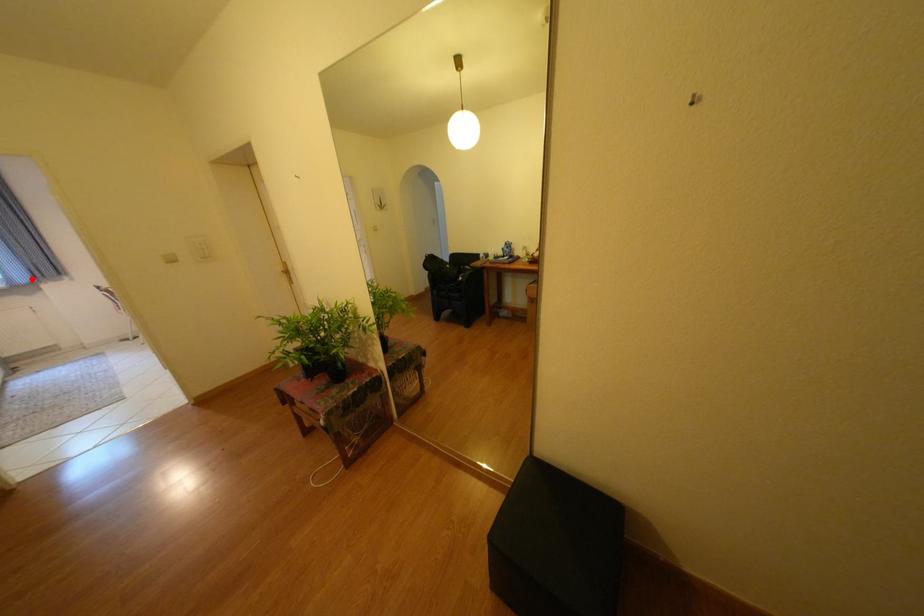
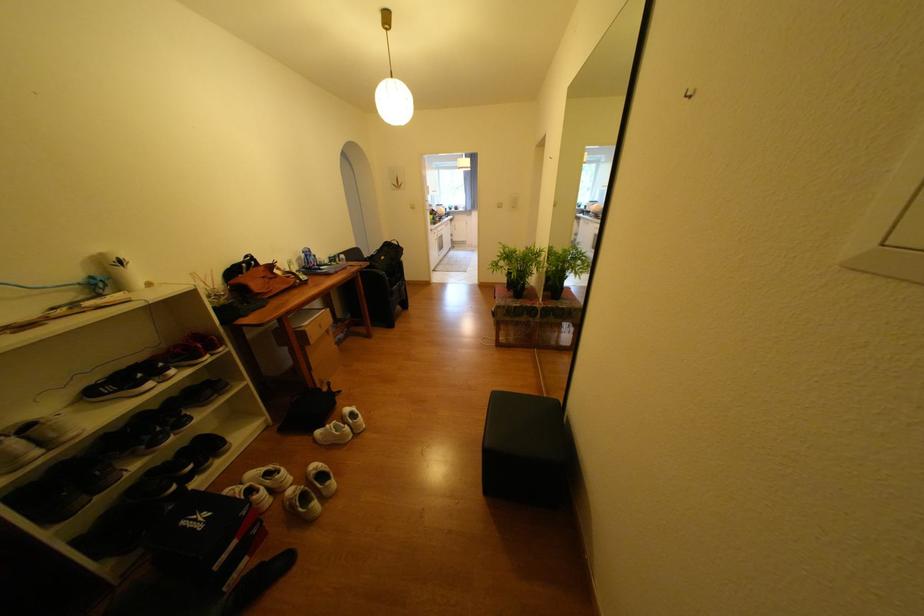
The point at the highlighted location is marked in the first image. Where is the corresponding point in the second image?

(479, 208)